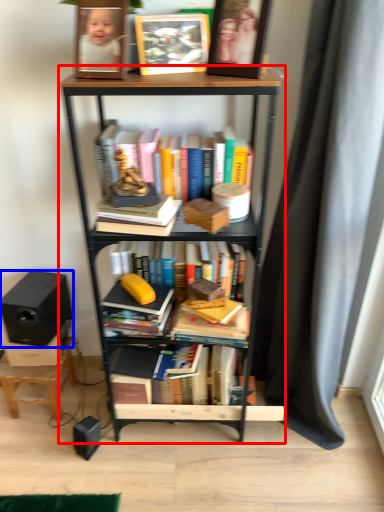
Question: Which object is closer to the camera taking this photo, bookcase (highlighted by a red box) or speaker (highlighted by a blue box)?

Choices:
 (A) bookcase
 (B) speaker

Answer: (A)